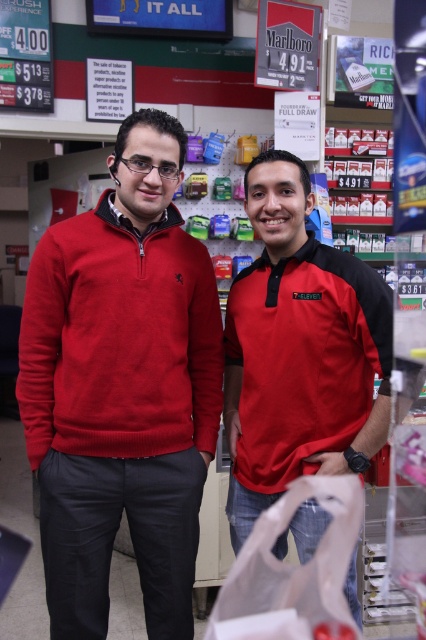
Question: Where is matte red sweater at center located in relation to transparent plastic bag at center in the image?

Choices:
 (A) left
 (B) right

Answer: (A)

Question: Can you confirm if matte red polo shirt at center is positioned to the right of transparent plastic bag at center?

Choices:
 (A) no
 (B) yes

Answer: (A)

Question: Which object is farther from the camera taking this photo?

Choices:
 (A) transparent plastic bag at center
 (B) matte red sweater at center
 (C) matte red polo shirt at center

Answer: (A)

Question: Which point appears closest to the camera in this image?

Choices:
 (A) click(146, 356)
 (B) click(255, 438)

Answer: (A)

Question: Among these points, which one is farthest from the camera?

Choices:
 (A) (264, 376)
 (B) (319, 566)
 (C) (32, 460)

Answer: (B)

Question: Is matte red sweater at center to the left of transparent plastic bag at center from the viewer's perspective?

Choices:
 (A) yes
 (B) no

Answer: (A)